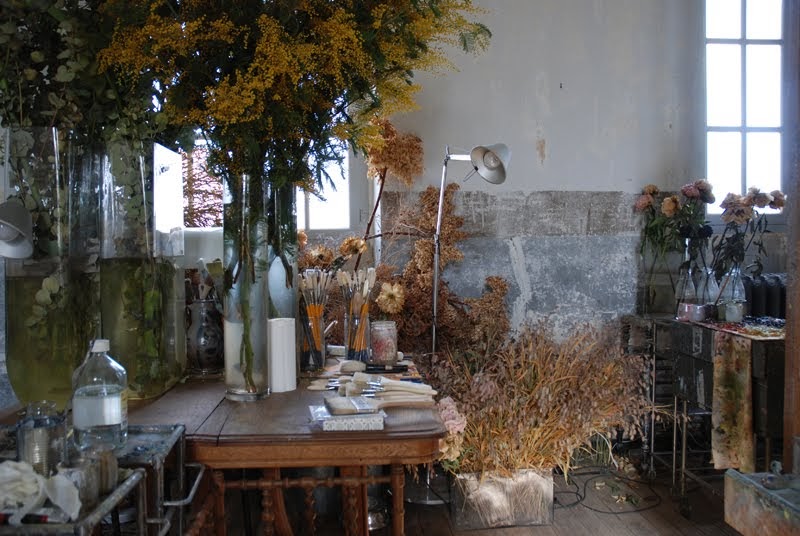
This screenshot has width=800, height=536. Find the location of `window`. window is located at coordinates (161, 177), (322, 193), (738, 74).